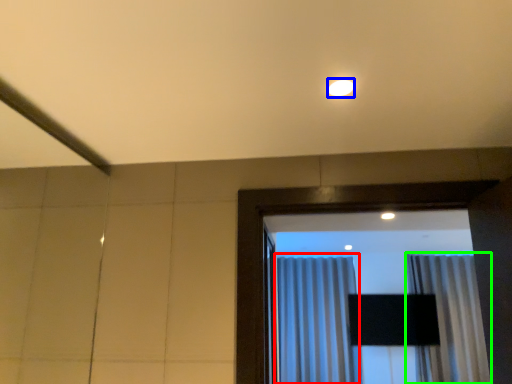
Question: Which object is the farthest from curtain (highlighted by a red box)? Choose among these: lighting (highlighted by a blue box) or curtain (highlighted by a green box).

Choices:
 (A) lighting
 (B) curtain

Answer: (A)